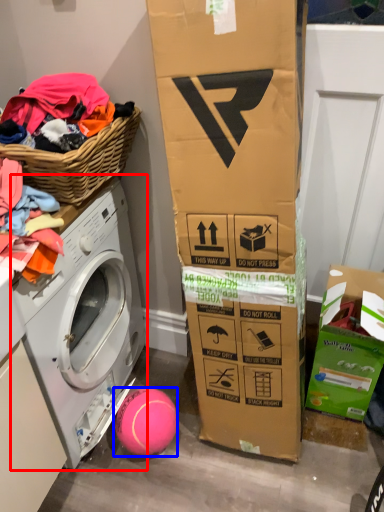
Question: Which of the following is the farthest to the observer, washing machine (highlighted by a red box) or ball (highlighted by a blue box)?

Choices:
 (A) washing machine
 (B) ball

Answer: (B)